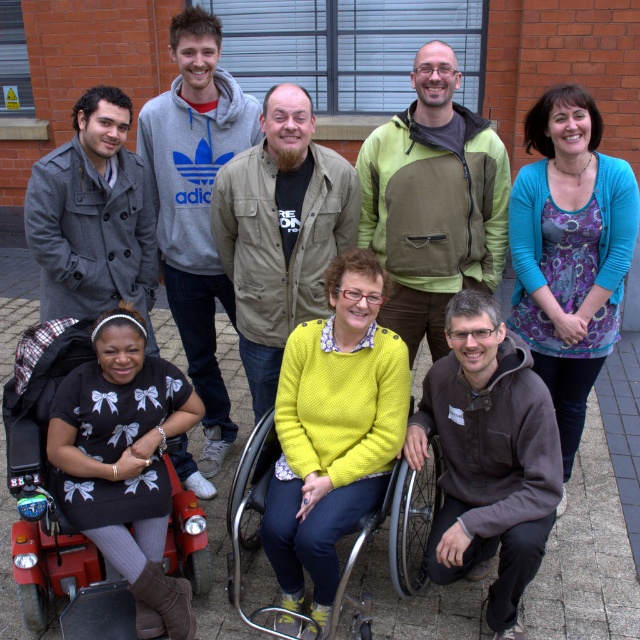
The image size is (640, 640). Find the location of `red plastic wheelchair at lower left`. red plastic wheelchair at lower left is located at coordinates 88,454.

Is the position of grey hoodie at upper left more distant than that of gray woolen coat at left?

Answer: Yes.

Measure the distance from grey hoodie at upper left to gray woolen coat at left.

16.95 inches

At what (x,y) coordinates should I click in order to perform the action: click on grey hoodie at upper left. Please return your answer as a coordinate pair (x, y). This screenshot has width=640, height=640. Looking at the image, I should click on (195, 214).

Is floral-patterned sweater at center above gray woolen coat at left?

No, floral-patterned sweater at center is not above gray woolen coat at left.

Is floral-patterned sweater at center behind gray woolen coat at left?

Yes, it is behind gray woolen coat at left.

Is point (625, 208) less distant than point (44, 246)?

No, (625, 208) is behind (44, 246).

Where is `floral-patterned sweater at center`? This screenshot has height=640, width=640. floral-patterned sweater at center is located at coordinates (570, 250).